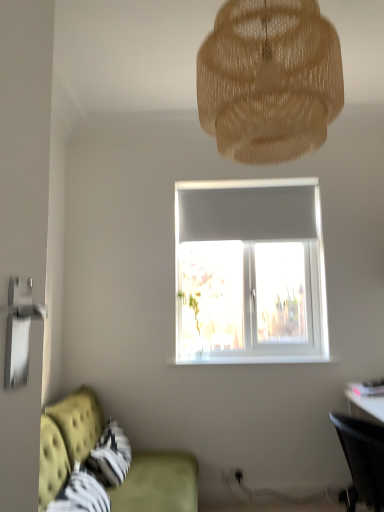
Question: From a real-world perspective, is velvet green couch at lower left positioned under translucent beige mesh at upper center based on gravity?

Choices:
 (A) no
 (B) yes

Answer: (B)

Question: From the image's perspective, is velvet green couch at lower left beneath translucent beige mesh at upper center?

Choices:
 (A) no
 (B) yes

Answer: (B)

Question: Does velvet green couch at lower left appear on the left side of translucent beige mesh at upper center?

Choices:
 (A) yes
 (B) no

Answer: (A)

Question: Is the position of velvet green couch at lower left less distant than that of translucent beige mesh at upper center?

Choices:
 (A) no
 (B) yes

Answer: (B)

Question: Is velvet green couch at lower left beside translucent beige mesh at upper center?

Choices:
 (A) yes
 (B) no

Answer: (B)

Question: From a real-world perspective, is velvet green couch at lower left located higher than translucent beige mesh at upper center?

Choices:
 (A) yes
 (B) no

Answer: (B)

Question: Is translucent beige mesh at upper center oriented away from velvet green couch at lower left?

Choices:
 (A) no
 (B) yes

Answer: (A)

Question: Can you confirm if translucent beige mesh at upper center is smaller than velvet green couch at lower left?

Choices:
 (A) yes
 (B) no

Answer: (A)

Question: From a real-world perspective, is translucent beige mesh at upper center positioned over velvet green couch at lower left based on gravity?

Choices:
 (A) no
 (B) yes

Answer: (B)

Question: Is translucent beige mesh at upper center at the right side of velvet green couch at lower left?

Choices:
 (A) no
 (B) yes

Answer: (B)

Question: Does translucent beige mesh at upper center come behind velvet green couch at lower left?

Choices:
 (A) yes
 (B) no

Answer: (A)

Question: From the image's perspective, is translucent beige mesh at upper center on top of velvet green couch at lower left?

Choices:
 (A) yes
 (B) no

Answer: (A)

Question: Is black mesh chair at lower right at the left side of velvet green couch at lower left?

Choices:
 (A) yes
 (B) no

Answer: (B)